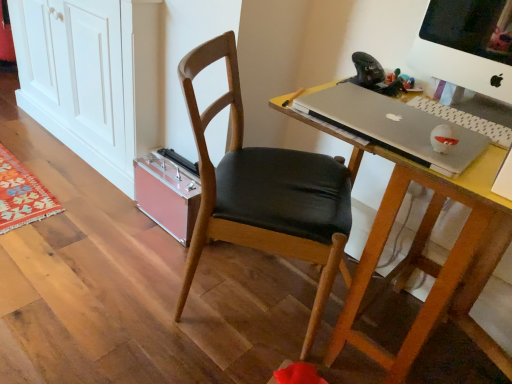
Question: Is white plastic computer monitor at upper right aimed at wooden desk at center?

Choices:
 (A) no
 (B) yes

Answer: (A)

Question: Considering the relative positions of white plastic computer monitor at upper right and wooden desk at center in the image provided, is white plastic computer monitor at upper right in front of wooden desk at center?

Choices:
 (A) no
 (B) yes

Answer: (A)

Question: Is the depth of white plastic computer monitor at upper right greater than that of wooden desk at center?

Choices:
 (A) no
 (B) yes

Answer: (B)

Question: From a real-world perspective, is white plastic computer monitor at upper right beneath wooden desk at center?

Choices:
 (A) no
 (B) yes

Answer: (A)

Question: Are white plastic computer monitor at upper right and wooden desk at center making contact?

Choices:
 (A) no
 (B) yes

Answer: (A)

Question: Considering the relative positions of white plastic computer monitor at upper right and wooden desk at center in the image provided, is white plastic computer monitor at upper right to the right of wooden desk at center from the viewer's perspective?

Choices:
 (A) yes
 (B) no

Answer: (A)

Question: Considering the relative positions of silver metallic laptop at center and gray matte laptop keyboard at right in the image provided, is silver metallic laptop at center to the right of gray matte laptop keyboard at right from the viewer's perspective?

Choices:
 (A) yes
 (B) no

Answer: (B)

Question: From the image's perspective, is silver metallic laptop at center on gray matte laptop keyboard at right?

Choices:
 (A) no
 (B) yes

Answer: (B)

Question: Does silver metallic laptop at center lie behind gray matte laptop keyboard at right?

Choices:
 (A) yes
 (B) no

Answer: (B)

Question: Could you tell me if silver metallic laptop at center is turned towards gray matte laptop keyboard at right?

Choices:
 (A) yes
 (B) no

Answer: (B)

Question: Is the position of silver metallic laptop at center less distant than that of gray matte laptop keyboard at right?

Choices:
 (A) yes
 (B) no

Answer: (A)

Question: Is silver metallic laptop at center far from gray matte laptop keyboard at right?

Choices:
 (A) no
 (B) yes

Answer: (A)

Question: Is wooden desk at center in contact with pink plastic cabinet at lower left?

Choices:
 (A) no
 (B) yes

Answer: (A)